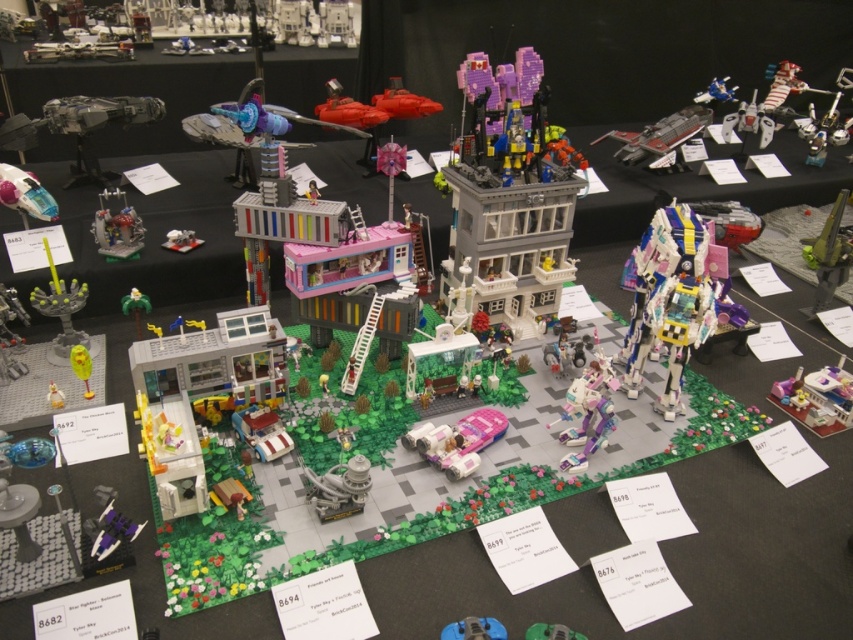
You are a visitor at the LEGO exhibition and want to take a photo of the metallic silver robot at center right and the green plastic toy at lower center. From your current position, which object will appear closer to you in the photo?

The metallic silver robot at center right will appear closer to you in the photo because the green plastic toy at lower center is positioned behind it.